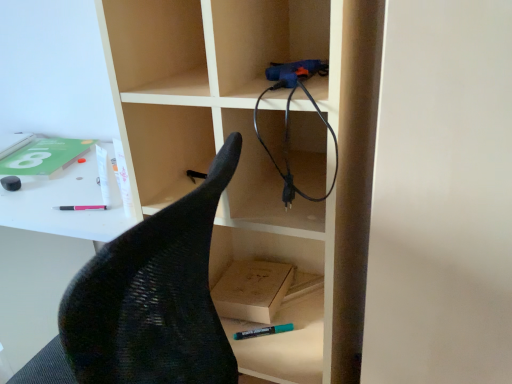
What are the coordinates of `free space in front of matte black eraser at left, which appears as the second stationery when viewed from the right` in the screenshot? It's located at (17, 205).